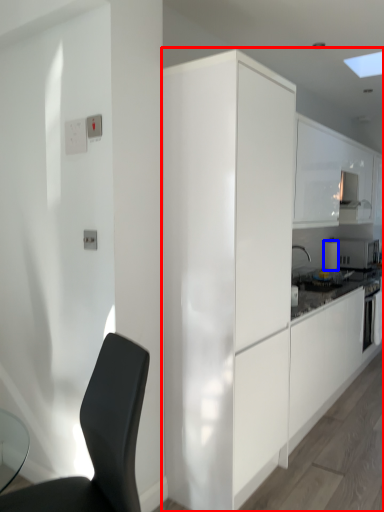
Question: Which object is further to the camera taking this photo, cabinetry (highlighted by a red box) or appliance (highlighted by a blue box)?

Choices:
 (A) cabinetry
 (B) appliance

Answer: (B)